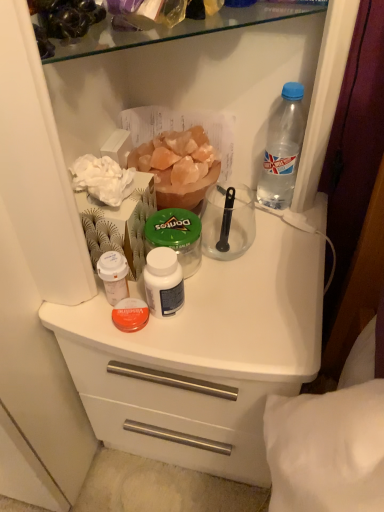
This screenshot has width=384, height=512. What are the coordinates of `vacant point to the right of transparent plastic spoon at center` in the screenshot? It's located at (283, 243).